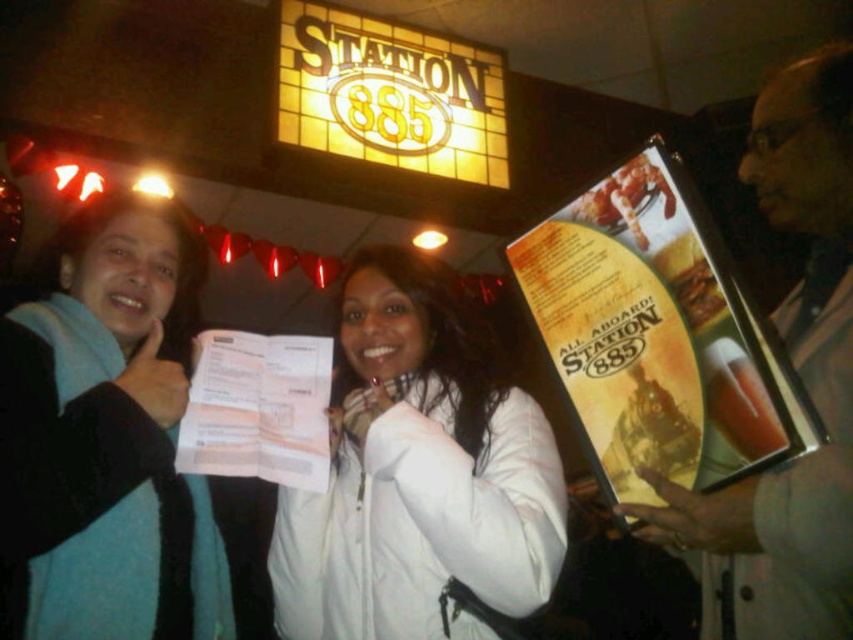
Question: Does white matte jacket at center have a lesser width compared to teal sweater at left?

Choices:
 (A) no
 (B) yes

Answer: (A)

Question: In this image, where is teal sweater at left located relative to matte plastic menu at right?

Choices:
 (A) below
 (B) above

Answer: (A)

Question: Which point is closer to the camera?

Choices:
 (A) (831, 346)
 (B) (659, 356)

Answer: (A)

Question: Which of the following is the closest to the observer?

Choices:
 (A) matte plastic menu at right
 (B) yellow paper menu at center
 (C) teal sweater at left
 (D) white matte jacket at center

Answer: (A)

Question: Which point appears farthest from the camera in this image?

Choices:
 (A) (640, 346)
 (B) (756, 518)

Answer: (A)

Question: Can you confirm if teal sweater at left is positioned below yellow paper menu at center?

Choices:
 (A) no
 (B) yes

Answer: (B)